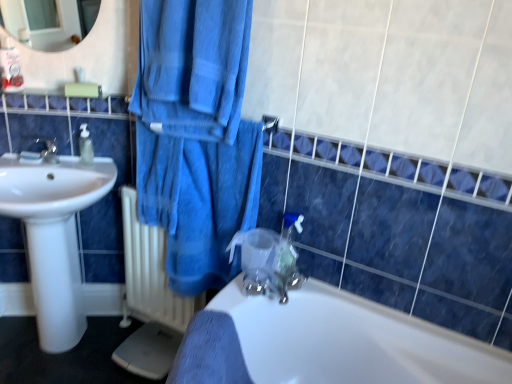
This screenshot has width=512, height=384. I want to click on transparent plastic faucet at center, so click(x=289, y=246).

Where is `white glossy sink at left`? The height and width of the screenshot is (384, 512). white glossy sink at left is located at coordinates (54, 235).

This screenshot has width=512, height=384. Describe the element at coordinates (193, 66) in the screenshot. I see `blue cotton towel at center` at that location.

Measure the distance between white plastic balustrade at upper center and camera.

The depth of white plastic balustrade at upper center is 5.64 feet.

Where is `white metallic radiator at lower left`? white metallic radiator at lower left is located at coordinates (151, 272).

From their relative heights in the image, would you say white glossy bathtub at lower center is taller or shorter than white plastic balustrade at upper center?

Considering their sizes, white glossy bathtub at lower center has more height than white plastic balustrade at upper center.

Considering the points (270, 377) and (37, 111), which point is behind, point (270, 377) or point (37, 111)?

The point (37, 111) is behind.

How many degrees apart are the facing directions of white glossy bathtub at lower center and white plastic balustrade at upper center?

125 degrees.

Does white glossy bathtub at lower center appear on the left side of white plastic balustrade at upper center?

Incorrect, white glossy bathtub at lower center is not on the left side of white plastic balustrade at upper center.

Is transparent plastic faucet at center next to white plastic balustrade at upper center?

There is a gap between transparent plastic faucet at center and white plastic balustrade at upper center.

Is transparent plastic faucet at center facing away from white plastic balustrade at upper center?

transparent plastic faucet at center is not turned away from white plastic balustrade at upper center.

In the scene shown: How many degrees apart are the facing directions of transparent plastic faucet at center and white plastic balustrade at upper center?

The angular difference between transparent plastic faucet at center and white plastic balustrade at upper center is 35.5 degrees.

Is transparent plastic faucet at center surrounding white plastic balustrade at upper center?

No, white plastic balustrade at upper center is not surrounded by transparent plastic faucet at center.

Is transparent plastic faucet at center completely or partially outside of white metallic radiator at lower left?

Yes, transparent plastic faucet at center is located beyond the bounds of white metallic radiator at lower left.

Where is `radiator that is below the transparent plastic faucet at center (from the image's perspective)`? radiator that is below the transparent plastic faucet at center (from the image's perspective) is located at coordinates (151, 272).

Which of these two, transparent plastic faucet at center or white metallic radiator at lower left, is thinner?

Thinner between the two is transparent plastic faucet at center.

Is point (283, 255) closer or farther from the camera than point (87, 150)?

Point (283, 255) is closer to the camera than point (87, 150).

From the picture: From the image's perspective, is transparent plastic faucet at center above or below clear plastic soap dispenser at left?

transparent plastic faucet at center is below clear plastic soap dispenser at left.

From a real-world perspective, is transparent plastic faucet at center positioned above or below clear plastic soap dispenser at left?

In terms of real-world spatial position, transparent plastic faucet at center is below clear plastic soap dispenser at left.

Does transparent plastic faucet at center lie behind clear plastic soap dispenser at left?

No, the depth of transparent plastic faucet at center is less than that of clear plastic soap dispenser at left.

From a real-world perspective, is blue cotton towel at center under white plastic balustrade at upper center?

Incorrect, from a real-world perspective, blue cotton towel at center is higher than white plastic balustrade at upper center.

Based on the photo, does blue cotton towel at center touch white plastic balustrade at upper center?

No, blue cotton towel at center is not in contact with white plastic balustrade at upper center.

Does point (238, 113) lie in front of point (82, 106)?

Yes.

How different are the orientations of blue cotton towel at center and white plastic balustrade at upper center in degrees?

There is a 34.5-degree angle between the facing directions of blue cotton towel at center and white plastic balustrade at upper center.

Would you consider white metallic radiator at lower left to be distant from white glossy bathtub at lower center?

Actually, white metallic radiator at lower left and white glossy bathtub at lower center are a little close together.

From the image's perspective, is white metallic radiator at lower left positioned above or below white glossy bathtub at lower center?

From the image's perspective, white metallic radiator at lower left appears above white glossy bathtub at lower center.

Who is shorter, white metallic radiator at lower left or white glossy bathtub at lower center?

white glossy bathtub at lower center is shorter.

Does white metallic radiator at lower left turn towards white glossy bathtub at lower center?

No, white metallic radiator at lower left is not oriented towards white glossy bathtub at lower center.

Considering the relative sizes of clear plastic soap dispenser at left and blue cotton towel at center in the image provided, is clear plastic soap dispenser at left thinner than blue cotton towel at center?

Correct, the width of clear plastic soap dispenser at left is less than that of blue cotton towel at center.

Consider the image. Can you see clear plastic soap dispenser at left touching blue cotton towel at center?

They are not placed beside each other.

From the image's perspective, is clear plastic soap dispenser at left on top of blue cotton towel at center?

No, from the image's perspective, clear plastic soap dispenser at left is not above blue cotton towel at center.

The height and width of the screenshot is (384, 512). Identify the location of bathtub in front of the white plastic balustrade at upper center. (326, 343).

The image size is (512, 384). In order to click on plumbing fixture beneath the white plastic balustrade at upper center (from a real-world perspective) in this screenshot , I will do `click(289, 246)`.

Estimate the real-world distances between objects in this image. Which object is further from white metallic radiator at lower left, clear plastic soap dispenser at left or white glossy sink at left?

clear plastic soap dispenser at left is positioned further to the anchor white metallic radiator at lower left.

When comparing their distances from white metallic radiator at lower left, does white glossy bathtub at lower center or white glossy sink at left seem further?

The object further to white metallic radiator at lower left is white glossy bathtub at lower center.

When comparing their distances from blue cotton towel at center, does white metallic radiator at lower left or white glossy sink at left seem further?

white metallic radiator at lower left is positioned further to the anchor blue cotton towel at center.

From the image, which object appears to be farther from white metallic radiator at lower left, white glossy bathtub at lower center or white plastic balustrade at upper center?

white plastic balustrade at upper center is further to white metallic radiator at lower left.

When comparing their distances from white metallic radiator at lower left, does transparent plastic faucet at center or white glossy sink at left seem closer?

white glossy sink at left lies closer to white metallic radiator at lower left than the other object.

Looking at the image, which one is located closer to white glossy bathtub at lower center, white plastic balustrade at upper center or white glossy sink at left?

white glossy sink at left is closer to white glossy bathtub at lower center.

Based on their spatial positions, is white plastic balustrade at upper center or white glossy sink at left further from blue cotton towel at center?

white glossy sink at left.

Looking at the image, which one is located further to white glossy bathtub at lower center, white glossy sink at left or blue cotton towel at center?

The object further to white glossy bathtub at lower center is white glossy sink at left.

At what (x,y) coordinates should I click in order to perform the action: click on bath towel between white plastic balustrade at upper center and transparent plastic faucet at center. Please return your answer as a coordinate pair (x, y). The width and height of the screenshot is (512, 384). Looking at the image, I should click on pos(193,66).

Where is `soap dispenser between white plastic balustrade at upper center and white glossy bathtub at lower center in the up-down direction`? This screenshot has width=512, height=384. soap dispenser between white plastic balustrade at upper center and white glossy bathtub at lower center in the up-down direction is located at coordinates (85, 145).

The image size is (512, 384). I want to click on sink between blue cotton towel at center and white metallic radiator at lower left in the up-down direction, so click(54, 235).

Where is `soap dispenser situated between white glossy sink at left and transparent plastic faucet at center from left to right`? soap dispenser situated between white glossy sink at left and transparent plastic faucet at center from left to right is located at coordinates (85, 145).